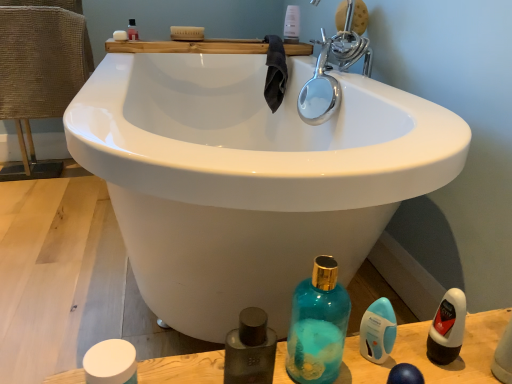
Question: Does dark gray towel at upper center turn towards teal glass bottle at lower center?

Choices:
 (A) no
 (B) yes

Answer: (A)

Question: Can you confirm if dark gray towel at upper center is bigger than teal glass bottle at lower center?

Choices:
 (A) no
 (B) yes

Answer: (B)

Question: From the image's perspective, is dark gray towel at upper center located above teal glass bottle at lower center?

Choices:
 (A) yes
 (B) no

Answer: (A)

Question: Is dark gray towel at upper center to the left of teal glass bottle at lower center from the viewer's perspective?

Choices:
 (A) no
 (B) yes

Answer: (B)

Question: Considering the relative sizes of dark gray towel at upper center and teal glass bottle at lower center in the image provided, is dark gray towel at upper center wider than teal glass bottle at lower center?

Choices:
 (A) yes
 (B) no

Answer: (A)

Question: Can we say dark gray towel at upper center lies outside teal glass bottle at lower center?

Choices:
 (A) no
 (B) yes

Answer: (B)

Question: Considering the relative sizes of white matte soap at upper left and teal glass bottle at lower center in the image provided, is white matte soap at upper left bigger than teal glass bottle at lower center?

Choices:
 (A) yes
 (B) no

Answer: (B)

Question: Could you tell me if white matte soap at upper left is facing teal glass bottle at lower center?

Choices:
 (A) yes
 (B) no

Answer: (B)

Question: Considering the relative sizes of white matte soap at upper left and teal glass bottle at lower center in the image provided, is white matte soap at upper left taller than teal glass bottle at lower center?

Choices:
 (A) no
 (B) yes

Answer: (A)

Question: Is white matte soap at upper left facing away from teal glass bottle at lower center?

Choices:
 (A) yes
 (B) no

Answer: (B)

Question: Is white matte soap at upper left smaller than teal glass bottle at lower center?

Choices:
 (A) yes
 (B) no

Answer: (A)

Question: Does white matte soap at upper left appear on the left side of teal glass bottle at lower center?

Choices:
 (A) yes
 (B) no

Answer: (A)

Question: Can you confirm if white matte jar at lower left, acting as the second mouthwash starting from the right, is bigger than translucent plastic bottle at upper center, which is the 2th toiletry from bottom to top?

Choices:
 (A) yes
 (B) no

Answer: (B)